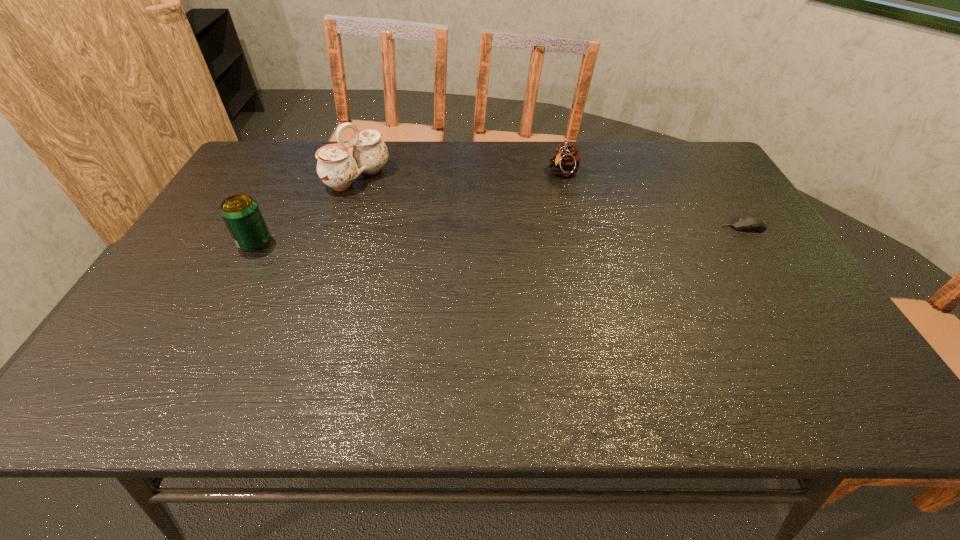
Find the location of a particular element. Image resolution: width=960 pixels, height=540 pixels. vacant region that satisfies the following two spatial constraints: 1. on the back side of the leftmost object; 2. on the left side of the shortest object is located at coordinates (264, 227).

What are the coordinates of `vacant region that satisfies the following two spatial constraints: 1. on the back side of the chinaware; 2. on the right side of the leftmost object` in the screenshot? It's located at (290, 178).